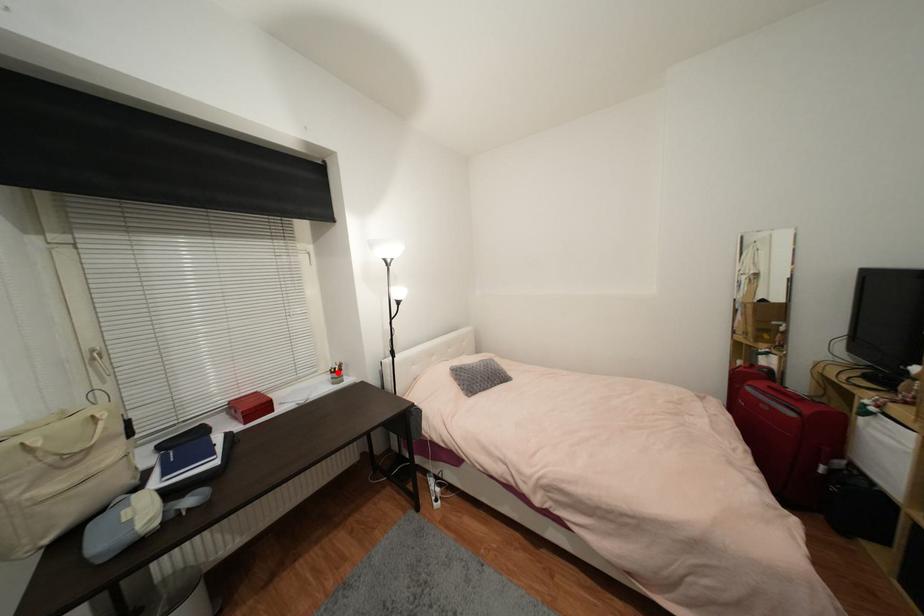
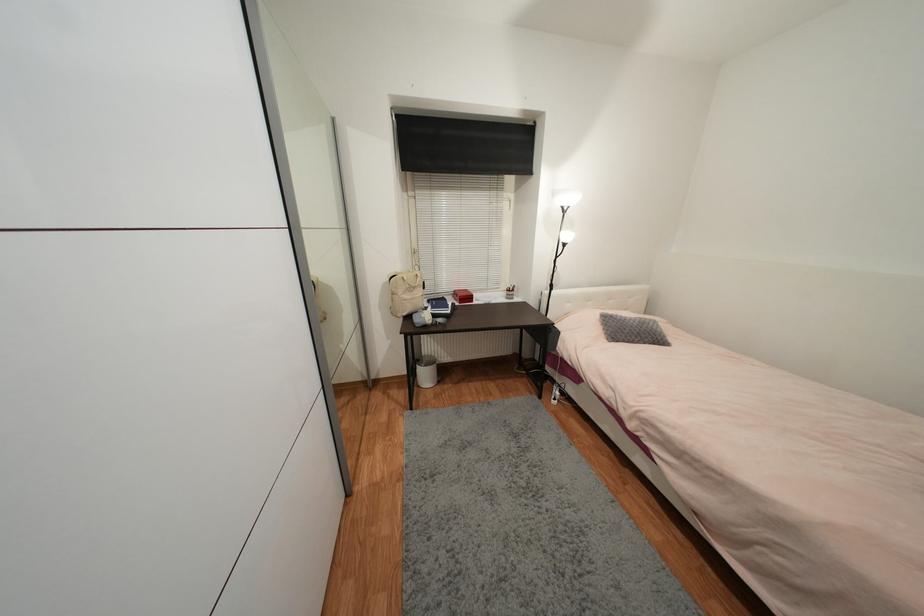
Question: I am providing you with two images of the same scene from different viewpoints. In image1, a red point is highlighted. Considering the same 3D point in image2, which of the following is correct?

Choices:
 (A) It is closer
 (B) It is farther

Answer: (A)